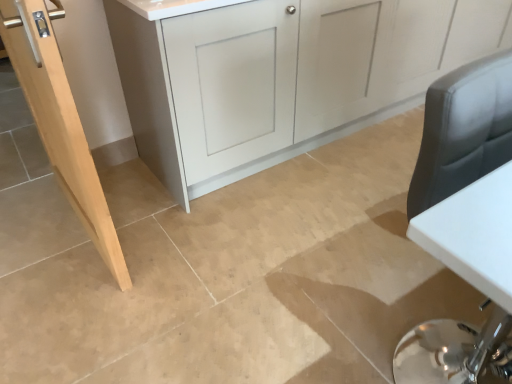
What do you see at coordinates (279, 71) in the screenshot? The image size is (512, 384). I see `matte gray cabinet at center` at bounding box center [279, 71].

Find the location of a particular element. The height and width of the screenshot is (384, 512). matte gray cabinet at center is located at coordinates (279, 71).

This screenshot has width=512, height=384. Identify the location of natural wood door at left. (60, 122).

Image resolution: width=512 pixels, height=384 pixels. What do you see at coordinates (60, 122) in the screenshot?
I see `natural wood door at left` at bounding box center [60, 122].

You are a GUI agent. You are given a task and a screenshot of the screen. Output one action in this format:
    pyautogui.click(x=<x>, y=<y>)
    Task: Click on the matte gray cabinet at center
    
    Given the screenshot: What is the action you would take?
    click(279, 71)

Based on their positions, is matte gray cabinet at center located to the left or right of natural wood door at left?

matte gray cabinet at center is to the right of natural wood door at left.

Does matte gray cabinet at center come in front of natural wood door at left?

No, it is not.

Is point (417, 0) positioned behind point (101, 234)?

Yes, point (417, 0) is behind point (101, 234).

From the image's perspective, who appears lower, matte gray cabinet at center or natural wood door at left?

From the image's view, natural wood door at left is below.

From a real-world perspective, is matte gray cabinet at center physically below natural wood door at left?

Yes, from a real-world perspective, matte gray cabinet at center is below natural wood door at left.

Considering the relative sizes of matte gray cabinet at center and natural wood door at left in the image provided, is matte gray cabinet at center thinner than natural wood door at left?

No, matte gray cabinet at center is not thinner than natural wood door at left.

Considering the relative sizes of matte gray cabinet at center and natural wood door at left in the image provided, is matte gray cabinet at center taller than natural wood door at left?

No.

Considering the sizes of matte gray cabinet at center and natural wood door at left in the image, is matte gray cabinet at center bigger or smaller than natural wood door at left?

Considering their sizes, matte gray cabinet at center takes up more space than natural wood door at left.

Would you say matte gray cabinet at center contains natural wood door at left?

No, natural wood door at left is not surrounded by matte gray cabinet at center.

Are matte gray cabinet at center and natural wood door at left making contact?

No, matte gray cabinet at center is not touching natural wood door at left.

Is matte gray cabinet at center facing towards natural wood door at left?

No.

Measure the distance from matte gray cabinet at center to natural wood door at left.

matte gray cabinet at center and natural wood door at left are 33.79 inches apart.

I want to click on cabinetry above the natural wood door at left (from the image's perspective), so click(279, 71).

Looking at this image, considering the positions of objects natural wood door at left and matte gray cabinet at center in the image provided, who is more to the left, natural wood door at left or matte gray cabinet at center?

From the viewer's perspective, natural wood door at left appears more on the left side.

Considering their positions, is natural wood door at left located in front of or behind matte gray cabinet at center?

natural wood door at left is positioned closer to the viewer than matte gray cabinet at center.

Which is in front, point (63, 152) or point (409, 77)?

The point (63, 152) is in front.

From the image's perspective, is natural wood door at left under matte gray cabinet at center?

Yes.

From a real-world perspective, is natural wood door at left positioned above or below matte gray cabinet at center?

natural wood door at left is above matte gray cabinet at center.

Considering the sizes of natural wood door at left and matte gray cabinet at center in the image, is natural wood door at left wider or thinner than matte gray cabinet at center?

In the image, natural wood door at left appears to be more narrow than matte gray cabinet at center.

Who is shorter, natural wood door at left or matte gray cabinet at center?

matte gray cabinet at center is shorter.

Considering the relative sizes of natural wood door at left and matte gray cabinet at center in the image provided, is natural wood door at left smaller than matte gray cabinet at center?

Indeed, natural wood door at left has a smaller size compared to matte gray cabinet at center.

Is natural wood door at left inside the boundaries of matte gray cabinet at center, or outside?

natural wood door at left cannot be found inside matte gray cabinet at center.

Is there a large distance between natural wood door at left and matte gray cabinet at center?

No, natural wood door at left is in close proximity to matte gray cabinet at center.

Is natural wood door at left facing away from matte gray cabinet at center?

Yes, natural wood door at left's orientation is away from matte gray cabinet at center.

Identify the location of door lying on the left of matte gray cabinet at center. (60, 122).

In the image, there is a natural wood door at left. Identify the location of cabinetry above it (from the image's perspective). Image resolution: width=512 pixels, height=384 pixels. (279, 71).

Locate an element on the screen. This screenshot has height=384, width=512. cabinetry that is on the right side of natural wood door at left is located at coordinates (279, 71).